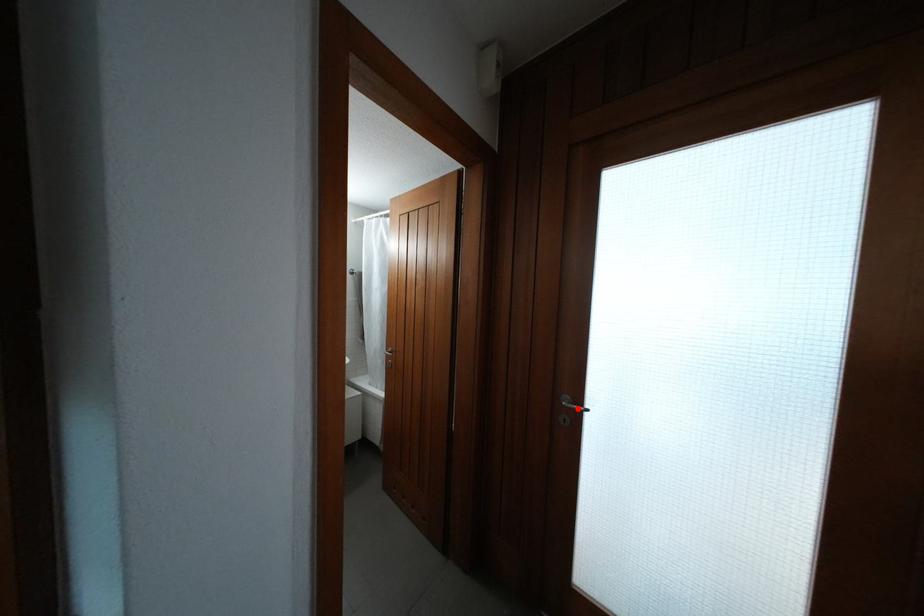
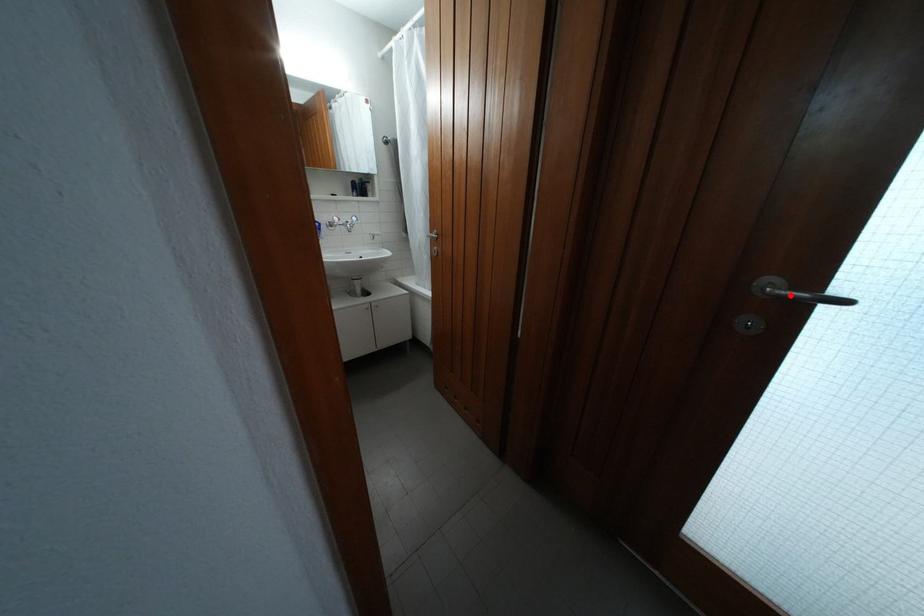
I am providing you with two images of the same scene from different viewpoints. A red point is marked on the first image and another point is marked on the second image. Does the point marked in image1 correspond to the same location as the one in image2?

Yes